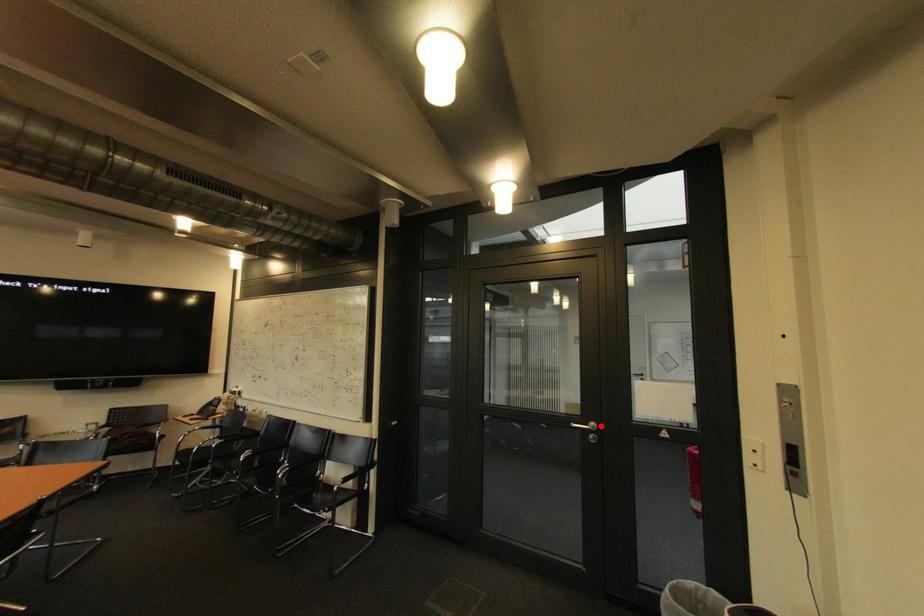
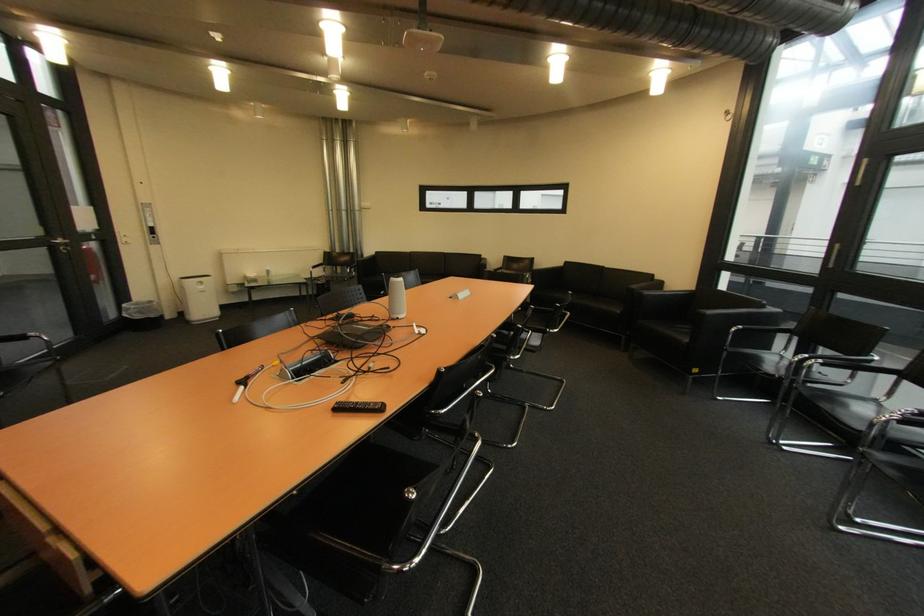
Find the pixel in the second image that matches the highlighted location in the first image.

(68, 241)